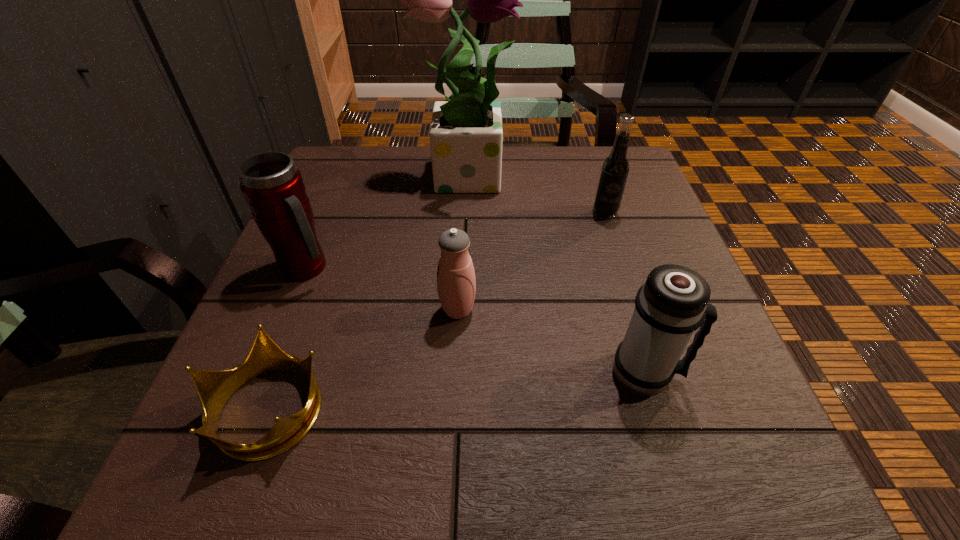
Where is `thermos bottle that is positioned at the right edge`? The width and height of the screenshot is (960, 540). thermos bottle that is positioned at the right edge is located at coordinates (672, 304).

Where is `object present at the near left corner`? Image resolution: width=960 pixels, height=540 pixels. object present at the near left corner is located at coordinates (214, 388).

This screenshot has height=540, width=960. What are the coordinates of `free space at the far edge` in the screenshot? It's located at (399, 167).

Identify the location of blank area at the near edge. (571, 434).

Find the location of a particular element. This screenshot has width=960, height=540. free spot at the left edge of the desktop is located at coordinates (338, 200).

Where is `vacant space at the right edge of the desktop`? vacant space at the right edge of the desktop is located at coordinates (655, 234).

In the image, there is a desktop. At what (x,y) coordinates should I click in order to perform the action: click on vacant space at the far left corner. Please return your answer as a coordinate pair (x, y). Looking at the image, I should click on (348, 193).

Where is `vacant space at the near left corner of the desktop`? This screenshot has width=960, height=540. vacant space at the near left corner of the desktop is located at coordinates (246, 500).

The width and height of the screenshot is (960, 540). In order to click on free space at the near right corner of the desktop in this screenshot , I will do `click(794, 482)`.

Where is `free spot between the farthest thermos bottle and the rightmost thermos bottle`? free spot between the farthest thermos bottle and the rightmost thermos bottle is located at coordinates (476, 320).